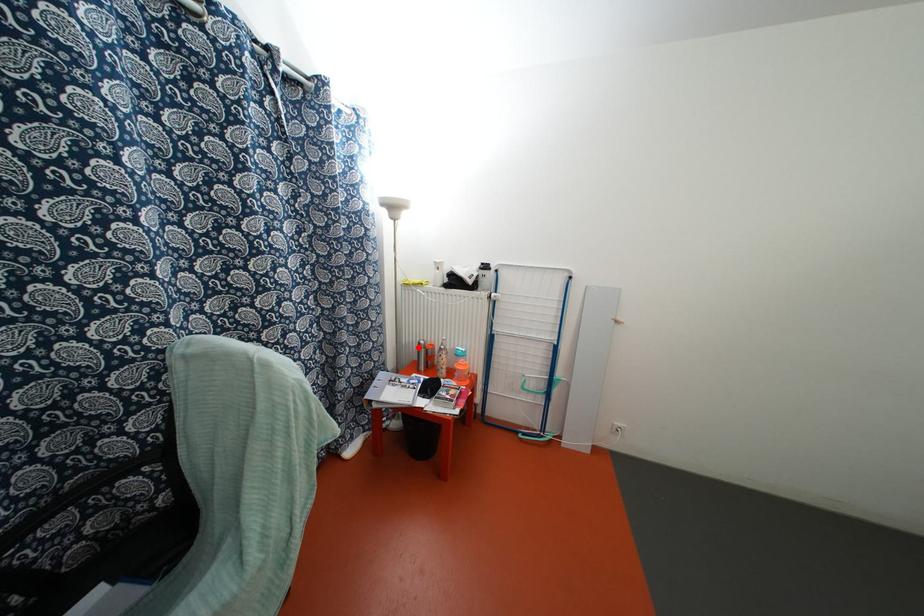
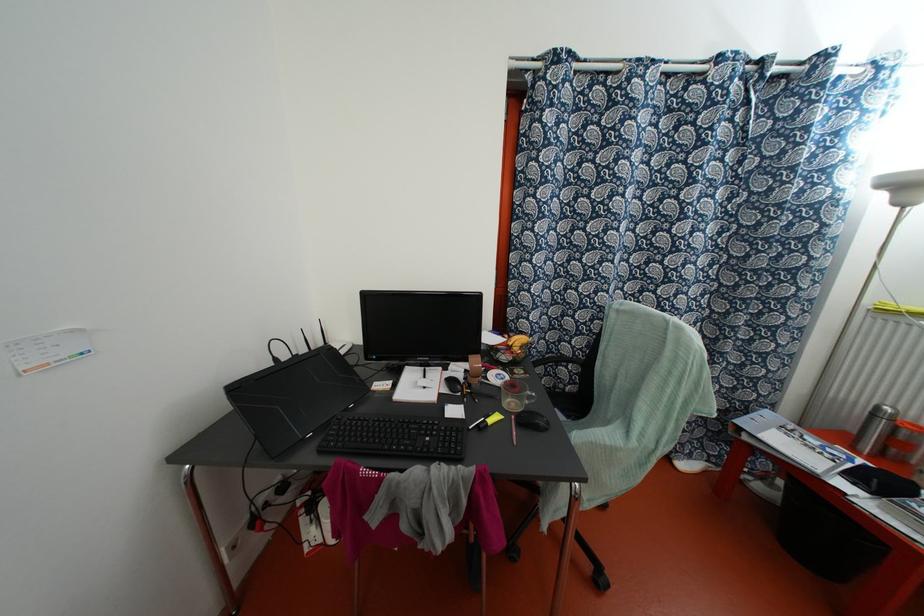
In the second image, find the point that corresponds to the highlighted location in the first image.

(872, 415)